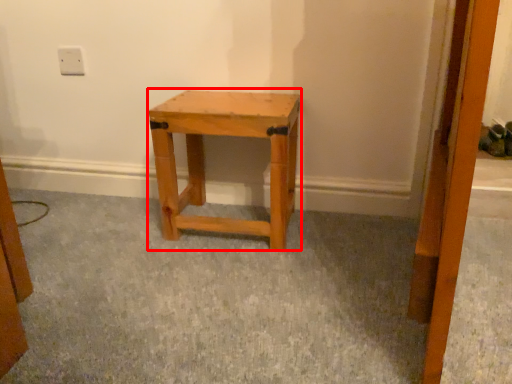
Question: From the image's perspective, considering the relative positions of stool (annotated by the red box) and electric outlet in the image provided, where is stool (annotated by the red box) located with respect to the staircase?

Choices:
 (A) below
 (B) above

Answer: (A)